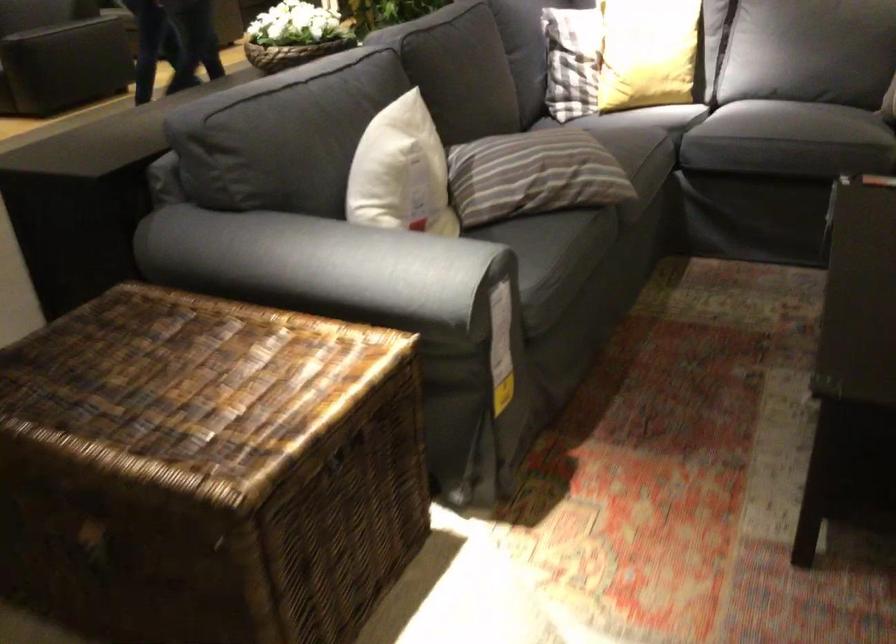
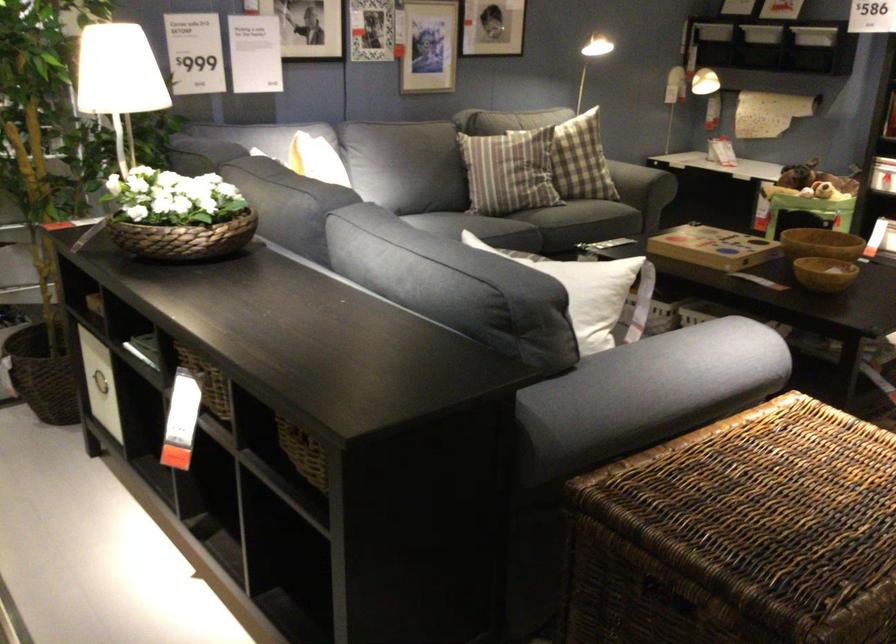
Question: I am providing you with two images of the same scene from different viewpoints. Which of the following objects are not visible in image2?

Choices:
 (A) yellow pillow
 (B) white pillow
 (C) plaid pillow
 (D) blue game controller

Answer: (A)